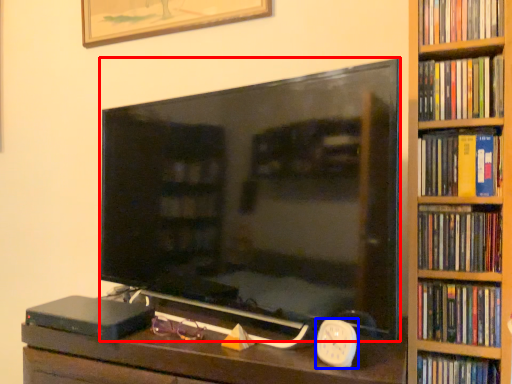
Question: Which point is further to the camera, television (highlighted by a red box) or clock (highlighted by a blue box)?

Choices:
 (A) television
 (B) clock

Answer: (B)